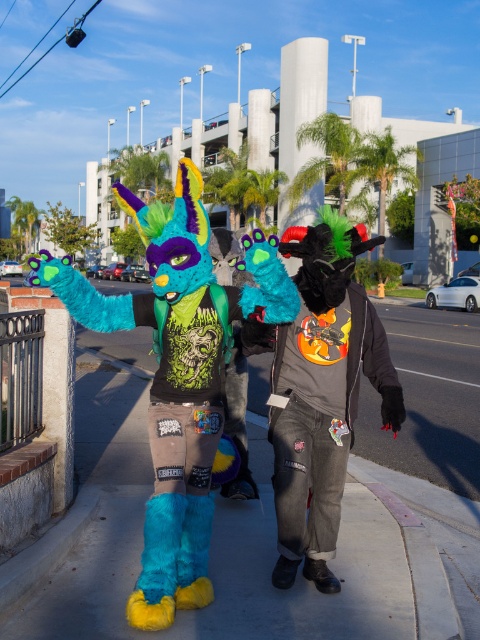
Question: In this image, where is fuzzy teal costume at center located relative to fuzzy teal and black costume at center?

Choices:
 (A) left
 (B) right

Answer: (A)

Question: Which point is closer to the camera?

Choices:
 (A) (280, 328)
 (B) (121, 326)

Answer: (B)

Question: Which object is farther from the camera taking this photo?

Choices:
 (A) fuzzy teal and black costume at center
 (B) fuzzy teal costume at center

Answer: (A)

Question: Can you confirm if fuzzy teal costume at center is thinner than fuzzy teal and black costume at center?

Choices:
 (A) no
 (B) yes

Answer: (A)

Question: Can you confirm if fuzzy teal costume at center is wider than fuzzy teal and black costume at center?

Choices:
 (A) no
 (B) yes

Answer: (B)